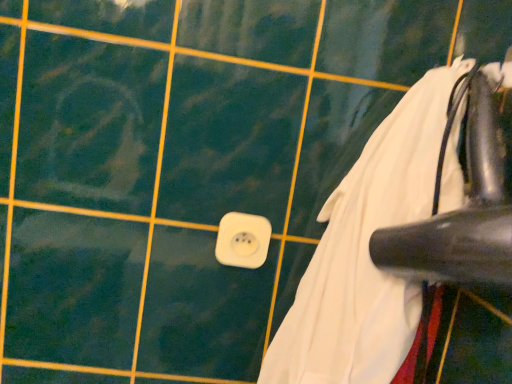
Question: Relative to white fabric at lower right, is white plastic socket at center in front or behind?

Choices:
 (A) behind
 (B) front

Answer: (A)

Question: In terms of size, does white plastic socket at center appear bigger or smaller than white fabric at lower right?

Choices:
 (A) small
 (B) big

Answer: (A)

Question: Does point (230, 215) appear closer or farther from the camera than point (338, 314)?

Choices:
 (A) closer
 (B) farther

Answer: (B)

Question: Visually, is white fabric at lower right positioned to the left or to the right of white plastic socket at center?

Choices:
 (A) left
 (B) right

Answer: (B)

Question: In the image, is white fabric at lower right positioned in front of or behind white plastic socket at center?

Choices:
 (A) front
 (B) behind

Answer: (A)

Question: Would you say white fabric at lower right is inside or outside white plastic socket at center?

Choices:
 (A) outside
 (B) inside

Answer: (A)

Question: Looking at the image, does white fabric at lower right seem bigger or smaller compared to white plastic socket at center?

Choices:
 (A) small
 (B) big

Answer: (B)